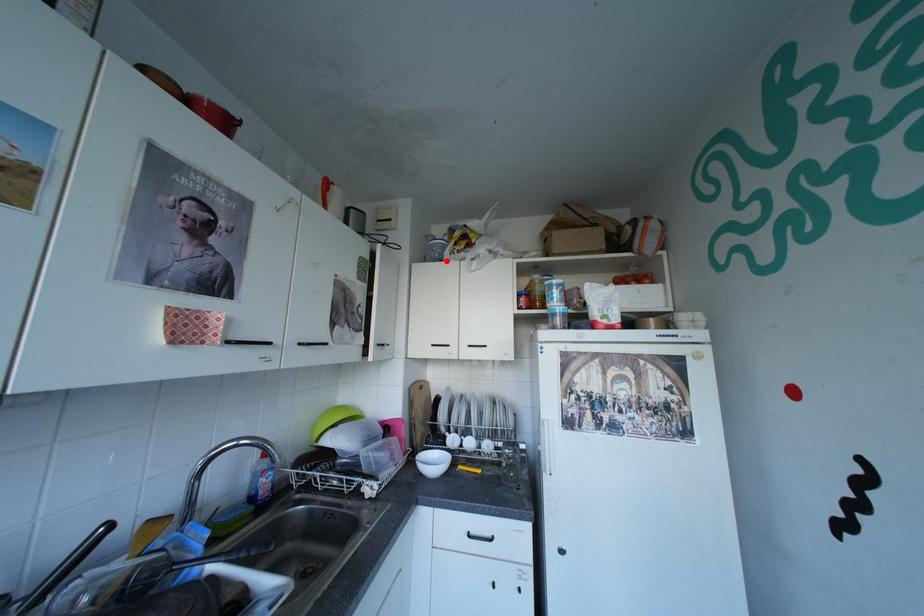
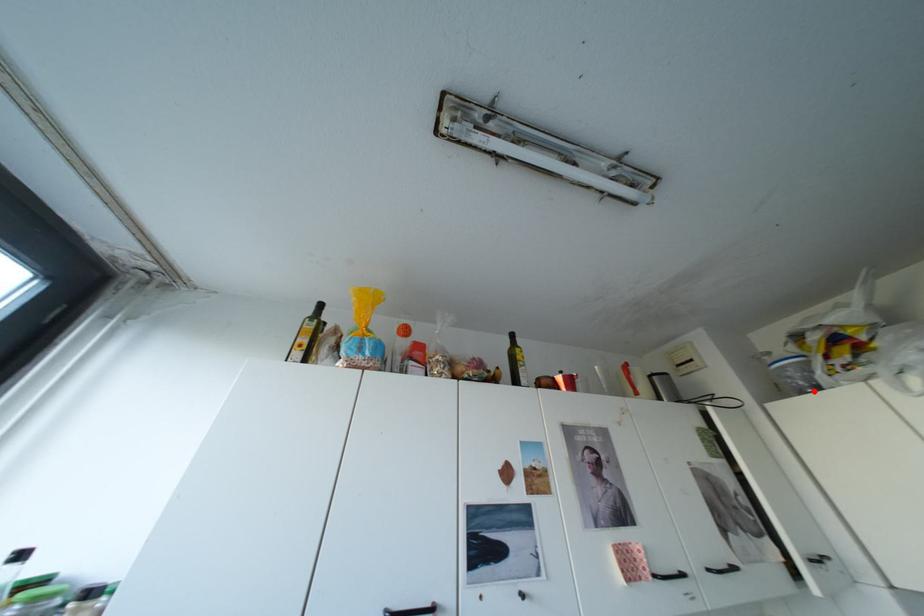
I am providing you with two images of the same scene from different viewpoints. A red point is marked on the first image and another point is marked on the second image. Does the point marked in image1 correspond to the same location as the one in image2?

Yes